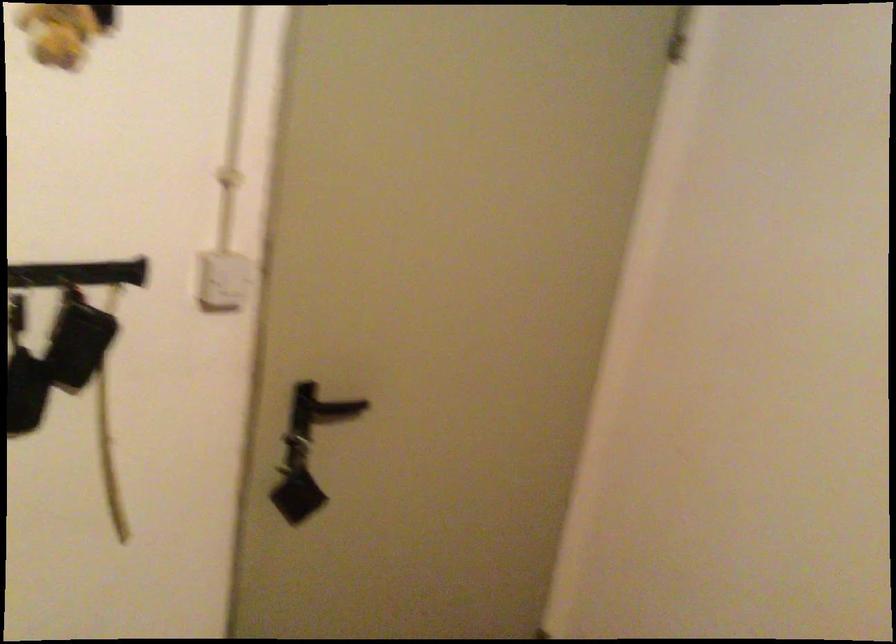
Question: Based on the continuous images, in which direction is the camera rotating? Reply with the corresponding letter.

Choices:
 (A) Left
 (B) Right
 (C) Up
 (D) Down

Answer: (A)